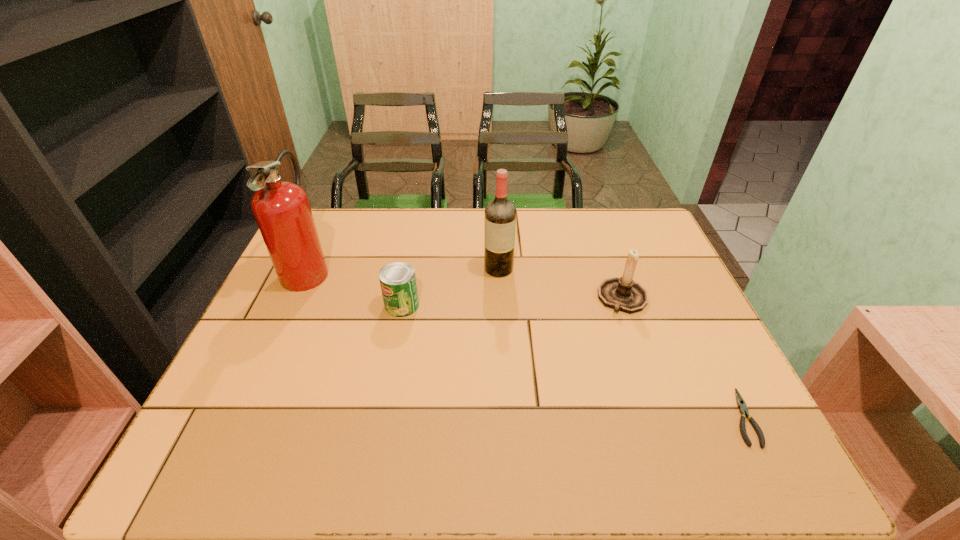
At what (x,y) coordinates should I click in order to perform the action: click on empty space that is in between the shortest object and the third object from right to left. Please return your answer as a coordinate pair (x, y). This screenshot has height=540, width=960. Looking at the image, I should click on (620, 343).

I want to click on empty space between the tallest object and the fourth object from left to right, so click(465, 284).

This screenshot has width=960, height=540. Identify the location of free space between the third shortest object and the fire extinguisher. (465, 284).

In order to click on vacant space that's between the leftmost object and the rightmost object in this screenshot , I will do `click(525, 343)`.

Locate an element on the screen. free point between the fourth object from right to left and the candle holder is located at coordinates (513, 302).

This screenshot has height=540, width=960. In order to click on free space between the second shortest object and the third object from right to left in this screenshot , I will do `click(450, 287)`.

In order to click on object identified as the closest to the second object from left to right in this screenshot , I will do `click(282, 210)`.

Identify which object is the fourth nearest to the second object from left to right. Please provide its 2D coordinates. Your answer should be formatted as a tuple, i.e. [(x, y)], where the tuple contains the x and y coordinates of a point satisfying the conditions above.

[(743, 410)]

At what (x,y) coordinates should I click in order to perform the action: click on free point that satisfies the following two spatial constraints: 1. on the front-facing side of the third object from left to right; 2. with the handle and nozzle on the tallest object. Please return your answer as a coordinate pair (x, y). The image size is (960, 540). Looking at the image, I should click on point(498,269).

I want to click on vacant position in the image that satisfies the following two spatial constraints: 1. on the front-facing side of the second tallest object; 2. on the left side of the pliers, so click(x=506, y=417).